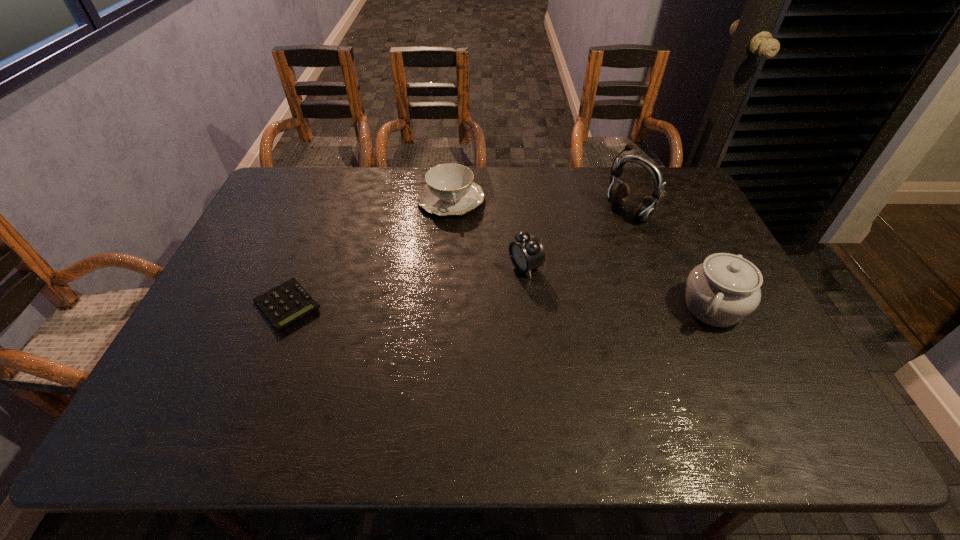
Locate an element on the screen. This screenshot has width=960, height=540. free space on the desktop that is between the leftmost object and the right chinaware and is positioned on the front side of the alarm clock is located at coordinates (446, 306).

The image size is (960, 540). Find the location of `vacant space on the desktop that is between the leftmost object and the nearer chinaware and is positioned on the ear pads of the tallest object`. vacant space on the desktop that is between the leftmost object and the nearer chinaware and is positioned on the ear pads of the tallest object is located at coordinates pos(477,307).

Where is `free space on the desktop that is between the leftmost object and the fourth shortest object and is positioned on the handle side of the farther chinaware`? free space on the desktop that is between the leftmost object and the fourth shortest object and is positioned on the handle side of the farther chinaware is located at coordinates [x=475, y=307].